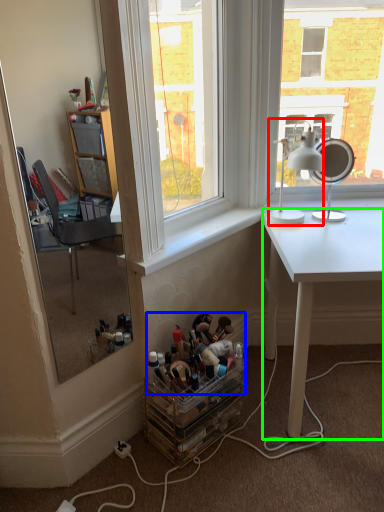
Question: Considering the real-world distances, which object is closest to table lamp (highlighted by a red box)? toy (highlighted by a blue box) or desk (highlighted by a green box).

Choices:
 (A) toy
 (B) desk

Answer: (B)